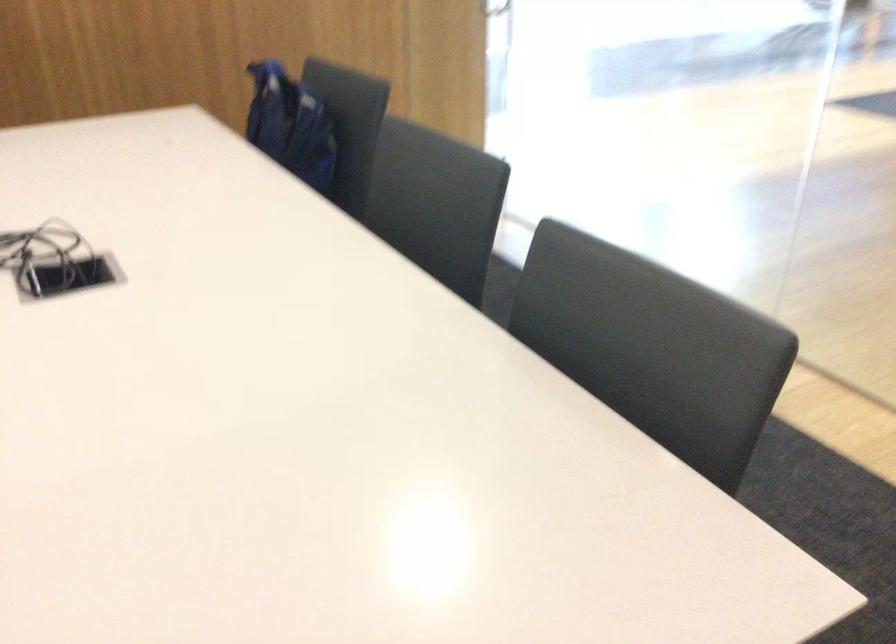
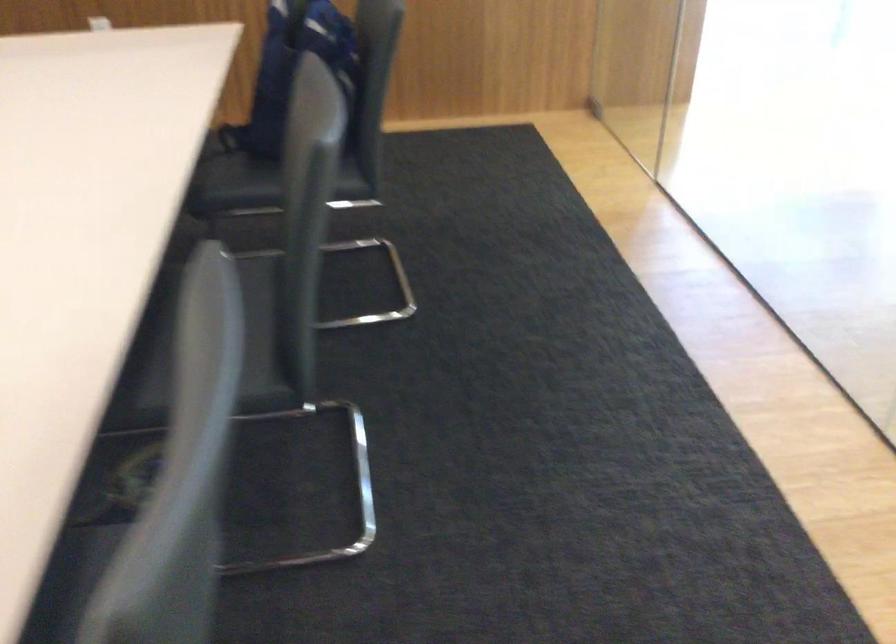
Question: Based on the continuous images, in which direction is the camera rotating? Reply with the corresponding letter.

Choices:
 (A) Left
 (B) Right
 (C) Up
 (D) Down

Answer: (A)